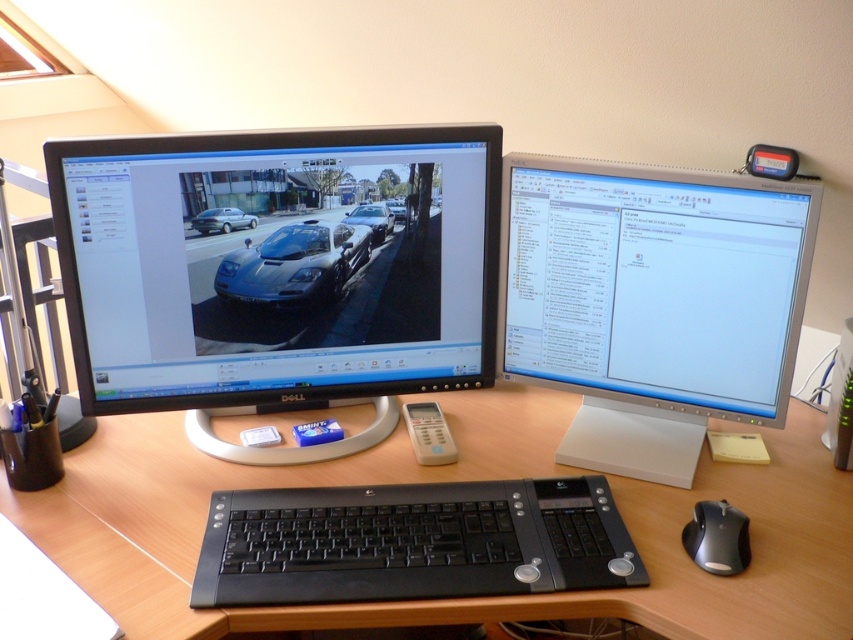
Question: Does satin silver monitor at upper right appear under glossy carbon fiber sports car at center?

Choices:
 (A) no
 (B) yes

Answer: (B)

Question: Which of the following is the closest to the observer?

Choices:
 (A) (718, 544)
 (B) (216, 212)
 (C) (271, 289)

Answer: (A)

Question: Does black plastic keyboard at center appear on the left side of shiny black car at center?

Choices:
 (A) yes
 (B) no

Answer: (B)

Question: Which point is closer to the camera?

Choices:
 (A) (595, 516)
 (B) (608, 342)
 (C) (80, 461)

Answer: (A)

Question: Which point is farther to the camera?

Choices:
 (A) satin silver monitor at upper right
 (B) black plastic mouse at lower right
 (C) black glossy monitor at left
 (D) black plastic keyboard at center

Answer: (A)

Question: Does satin silver monitor at upper right come in front of black plastic keyboard at center?

Choices:
 (A) yes
 (B) no

Answer: (B)